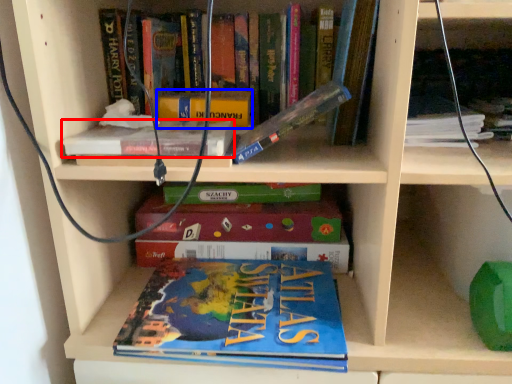
Question: Which object is closer to the camera taking this photo, book (highlighted by a red box) or paperback book (highlighted by a blue box)?

Choices:
 (A) book
 (B) paperback book

Answer: (A)